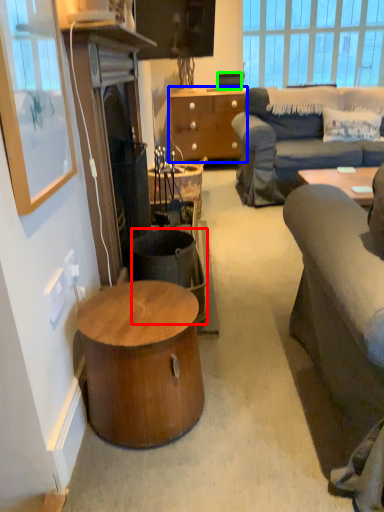
Question: Estimate the real-world distances between objects in this image. Which object is closer to trash bin/can (highlighted by a red box), cabinetry (highlighted by a blue box) or speaker (highlighted by a green box)?

Choices:
 (A) cabinetry
 (B) speaker

Answer: (A)